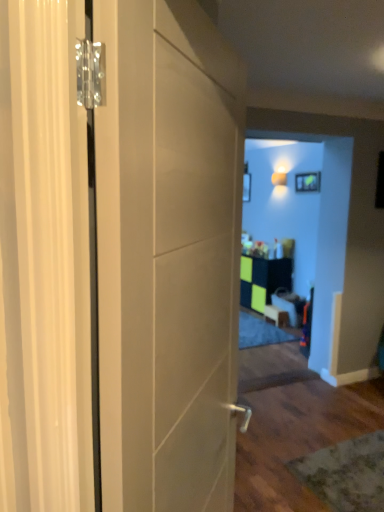
Question: Considering the relative positions of matte green picture frame at upper center and green matte cabinet at center in the image provided, is matte green picture frame at upper center to the left or to the right of green matte cabinet at center?

Choices:
 (A) right
 (B) left

Answer: (A)

Question: Is matte green picture frame at upper center inside or outside of green matte cabinet at center?

Choices:
 (A) outside
 (B) inside

Answer: (A)

Question: Which object is positioned farthest from the matte green picture frame at upper center?

Choices:
 (A) matte black cabinet at center, which is the first furniture in left-to-right order
 (B) green matte cabinet at center
 (C) matte white door at left
 (D) wooden table at center, which ranks as the second furniture in left-to-right order

Answer: (C)

Question: Which of these objects is positioned closest to the wooden table at center, the 1th furniture viewed from the right?

Choices:
 (A) matte black cabinet at center, which appears as the 2th furniture when viewed from the right
 (B) green matte cabinet at center
 (C) matte green picture frame at upper center
 (D) matte white door at left

Answer: (A)